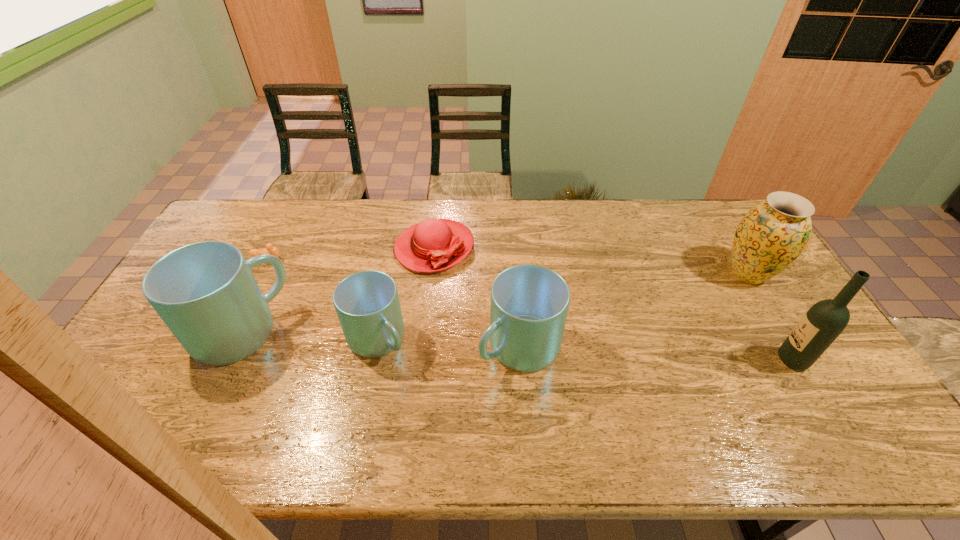
I want to click on the leftmost mug, so click(x=206, y=294).

The width and height of the screenshot is (960, 540). Identify the location of the shortest mug. (367, 304).

Locate an element on the screen. the fifth tallest object is located at coordinates (367, 304).

Locate an element on the screen. This screenshot has height=540, width=960. the second shortest mug is located at coordinates (529, 305).

Locate an element on the screen. the third object from right to left is located at coordinates (529, 305).

Find the location of a particular element. vase is located at coordinates (773, 233).

The image size is (960, 540). I want to click on hat, so click(432, 245).

Image resolution: width=960 pixels, height=540 pixels. What are the coordinates of `the shortest object` in the screenshot? It's located at (269, 249).

Image resolution: width=960 pixels, height=540 pixels. Identify the location of wine bottle. (820, 326).

This screenshot has width=960, height=540. Find the location of `blank area located 0.120m on the left of the leftmost mug`. blank area located 0.120m on the left of the leftmost mug is located at coordinates (153, 333).